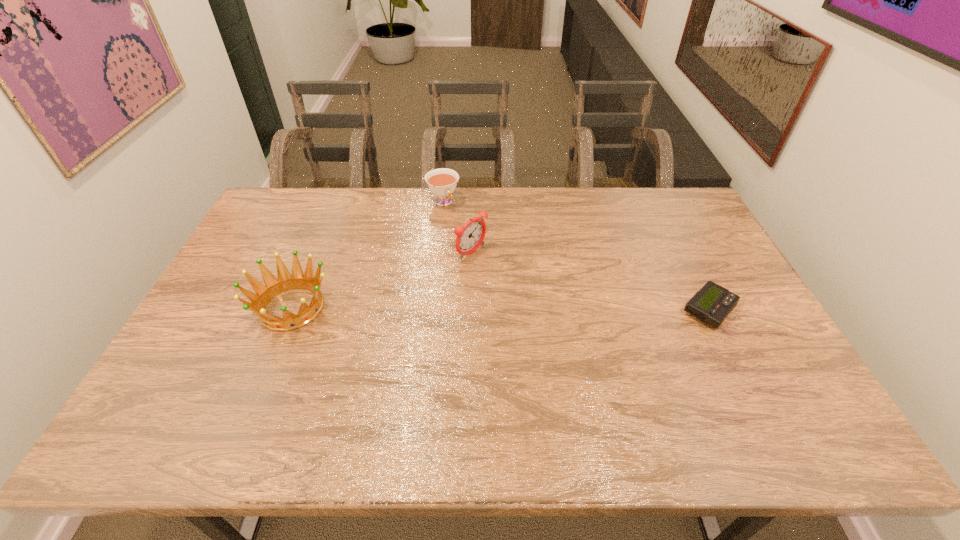
You are a GUI agent. You are given a task and a screenshot of the screen. Output one action in this format:
    pyautogui.click(x=<x>, y=<y>)
    Task: Click on the leftmost object
    
    Given the screenshot: What is the action you would take?
    pyautogui.click(x=263, y=295)

Where is `the rightmost object`? This screenshot has height=540, width=960. the rightmost object is located at coordinates (713, 303).

This screenshot has height=540, width=960. In order to click on beeper in this screenshot , I will do `click(713, 303)`.

Find the location of `the second farthest object`. the second farthest object is located at coordinates click(x=470, y=236).

This screenshot has height=540, width=960. What are the coordinates of `the tallest object` in the screenshot? It's located at (470, 236).

Where is `the farthest object`? The width and height of the screenshot is (960, 540). the farthest object is located at coordinates (442, 182).

Where is `free space located on the back of the leftmost object`? free space located on the back of the leftmost object is located at coordinates (312, 259).

Locate an element on the screen. The width and height of the screenshot is (960, 540). vacant area situated 0.110m on the back of the rightmost object is located at coordinates (686, 265).

In order to click on free space located 0.370m on the front-facing side of the tallest object in this screenshot , I will do `click(582, 322)`.

Identify the location of vacant space located 0.310m on the front-facing side of the tallest object. (x=564, y=311).